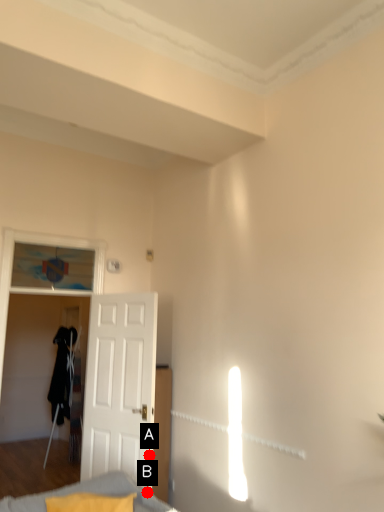
Question: Two points are circled on the image, labeled by A and B beside each circle. Which point is closer to the camera?

Choices:
 (A) A is closer
 (B) B is closer

Answer: (B)